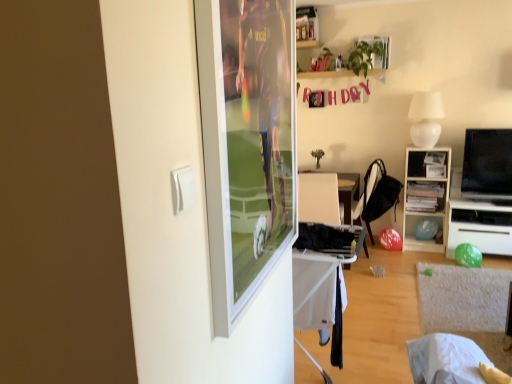
Where is `vacant region under black glossy tv at right (from a real-world perspective)`? This screenshot has height=384, width=512. vacant region under black glossy tv at right (from a real-world perspective) is located at coordinates (489, 203).